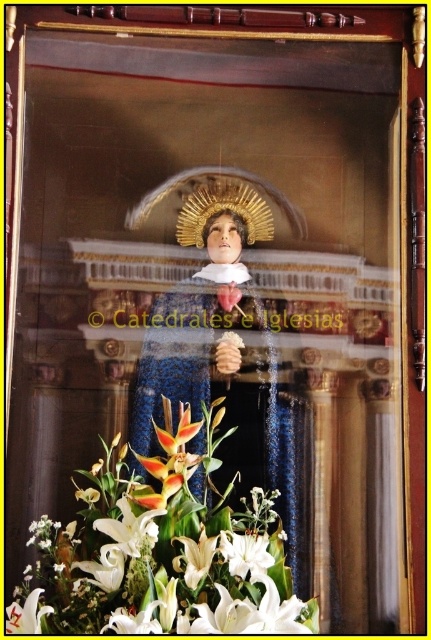
Which is behind, point (171, 452) or point (6, 628)?

Point (171, 452)

I want to click on white lilies at lower center, so click(162, 547).

Who is more forward, (250,566) or (30,620)?

Point (30,620) is in front.

Identify the location of white lily at lower center. (246, 554).

Looking at this image, can you confirm if white lilies at lower center is positioned to the left of white lily at lower center?

Indeed, white lilies at lower center is positioned on the left side of white lily at lower center.

Does white lilies at lower center have a greater height compared to white lily at lower center?

Yes, white lilies at lower center is taller than white lily at lower center.

Which is in front, point (244, 618) or point (231, 556)?

Point (244, 618) is more forward.

Image resolution: width=431 pixels, height=640 pixels. I want to click on white lilies at lower center, so click(x=162, y=547).